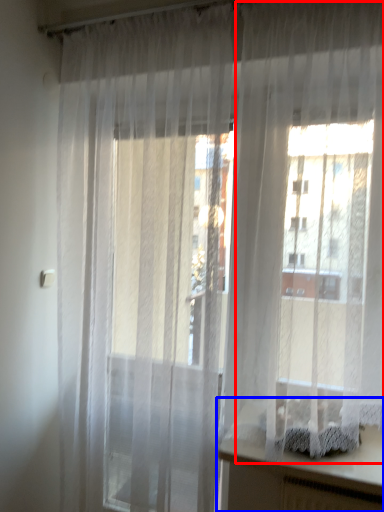
Question: Among these objects, which one is farthest to the camera, curtain (highlighted by a red box) or vanity (highlighted by a blue box)?

Choices:
 (A) curtain
 (B) vanity

Answer: (B)